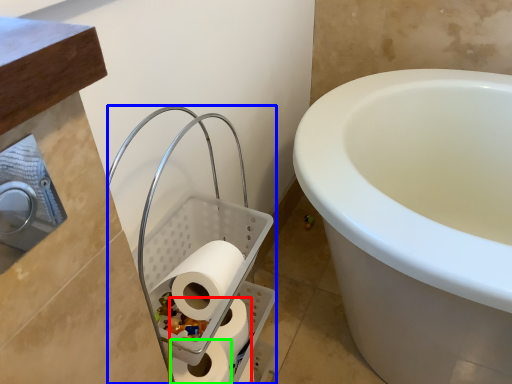
Question: Estimate the real-world distances between objects in this image. Which object is closer to toilet paper (highlighted by a red box), laundry basket (highlighted by a blue box) or toilet paper (highlighted by a green box)?

Choices:
 (A) laundry basket
 (B) toilet paper

Answer: (B)